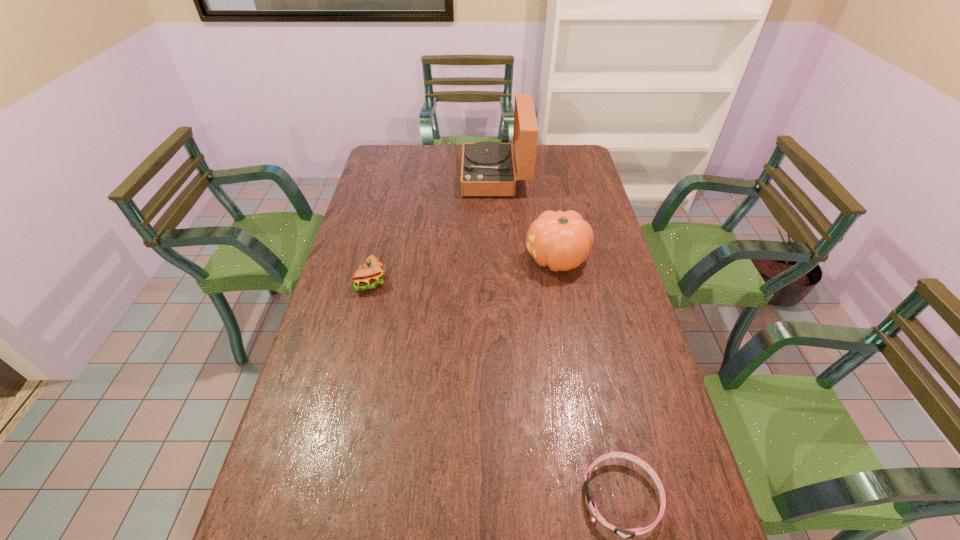
Where is `vacant space that's between the tallest object and the pumpkin`? The image size is (960, 540). vacant space that's between the tallest object and the pumpkin is located at coordinates point(526,218).

At what (x,y) coordinates should I click in order to perform the action: click on free space between the tallest object and the third shortest object. Please return your answer as a coordinate pair (x, y). Image resolution: width=960 pixels, height=540 pixels. Looking at the image, I should click on (526, 218).

At what (x,y) coordinates should I click in order to perform the action: click on vacant space that's between the pumpkin and the phonograph record. Please return your answer as a coordinate pair (x, y). This screenshot has width=960, height=540. Looking at the image, I should click on (526, 218).

The image size is (960, 540). Identify the location of free spot between the second tallest object and the phonograph record. (526, 218).

The width and height of the screenshot is (960, 540). I want to click on free space between the second tallest object and the sandwich, so click(465, 271).

At what (x,y) coordinates should I click in order to perform the action: click on free spot between the second tallest object and the phonograph record. Please return your answer as a coordinate pair (x, y). Image resolution: width=960 pixels, height=540 pixels. Looking at the image, I should click on point(526,218).

Locate an element on the screen. This screenshot has height=540, width=960. vacant region between the tallest object and the leftmost object is located at coordinates (434, 230).

The height and width of the screenshot is (540, 960). I want to click on object that is the second closest to the tallest object, so click(370, 275).

Identify the location of object that is the closest to the nearest object. The height and width of the screenshot is (540, 960). (560, 240).